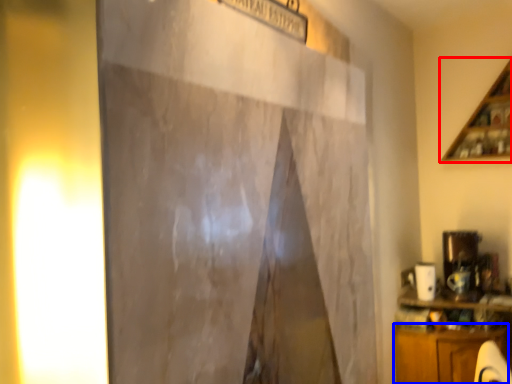
Question: Which of the following is the farthest to the observer, shelf (highlighted by a red box) or cabinetry (highlighted by a blue box)?

Choices:
 (A) shelf
 (B) cabinetry

Answer: (A)